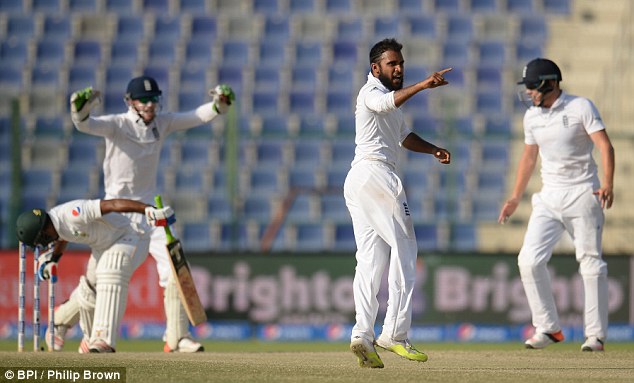
Find the location of `stairs`. stairs is located at coordinates (593, 52), (600, 26), (607, 5), (585, 77), (531, 184), (520, 213), (513, 236).